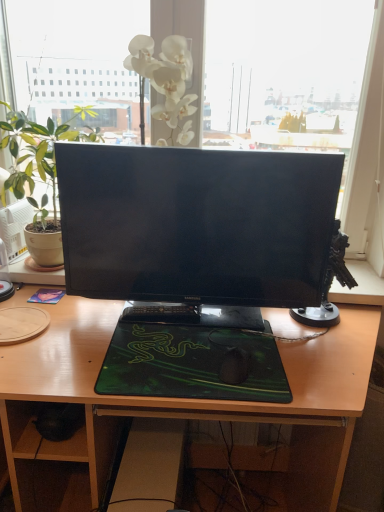
You are a GUI agent. You are given a task and a screenshot of the screen. Output one action in this format:
    pyautogui.click(x=<x>, y=<y>)
    Task: Click on the vacant area situated below green matte mousepad at center (from a real-world perspective)
    
    Given the screenshot: What is the action you would take?
    pyautogui.click(x=203, y=350)